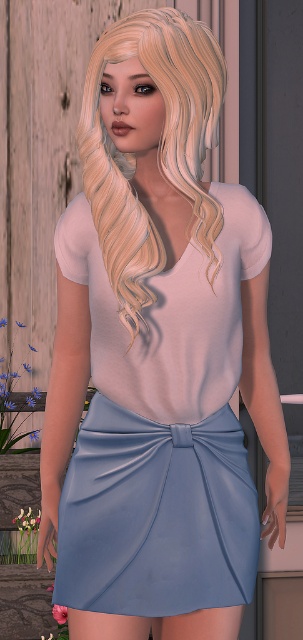
Which of these two, satin blue skirt at center or blondehair at center, stands shorter?

With less height is satin blue skirt at center.

Image resolution: width=303 pixels, height=640 pixels. What do you see at coordinates (156, 515) in the screenshot? I see `satin blue skirt at center` at bounding box center [156, 515].

Find the location of a particular element. This screenshot has width=303, height=640. satin blue skirt at center is located at coordinates (156, 515).